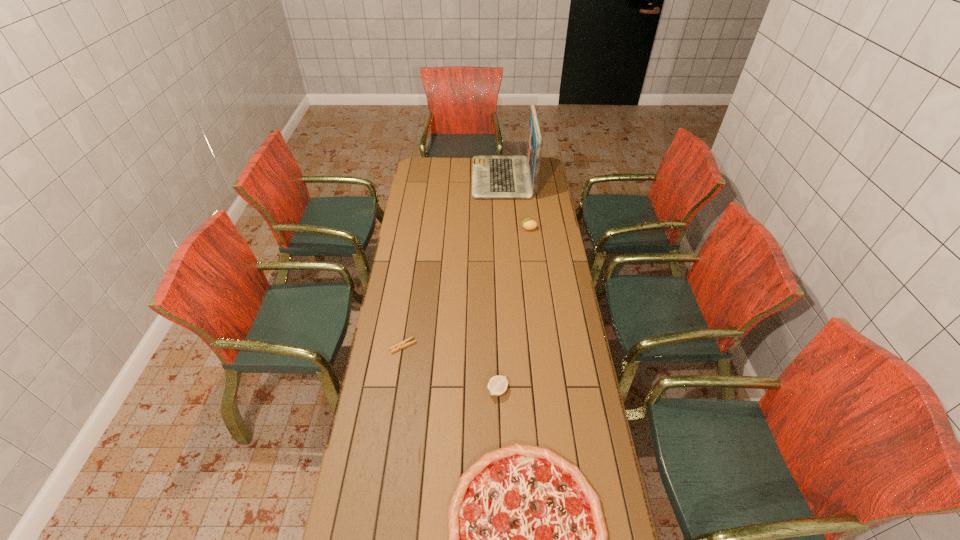
The width and height of the screenshot is (960, 540). I want to click on the farthest object, so click(x=493, y=176).

At what (x,y) coordinates should I click in order to perform the action: click on laptop computer. Please return your answer as a coordinate pair (x, y). The image size is (960, 540). Looking at the image, I should click on (493, 176).

Identify the location of the taller lemon. (528, 224).

Locate an element on the screen. This screenshot has height=540, width=960. the second tallest object is located at coordinates (528, 224).

Locate an element on the screen. The width and height of the screenshot is (960, 540). the shorter lemon is located at coordinates (497, 385).

Identify the location of the third tallest object. (497, 385).

Image resolution: width=960 pixels, height=540 pixels. What are the coordinates of `clothespin` in the screenshot? It's located at (405, 343).

Where is `the shortest object`? The height and width of the screenshot is (540, 960). the shortest object is located at coordinates (405, 343).

The width and height of the screenshot is (960, 540). Find the location of `vacant space located on the screen of the tallest object`. vacant space located on the screen of the tallest object is located at coordinates (460, 178).

The image size is (960, 540). What are the coordinates of `free space located on the screen of the tallest object` in the screenshot? It's located at (436, 178).